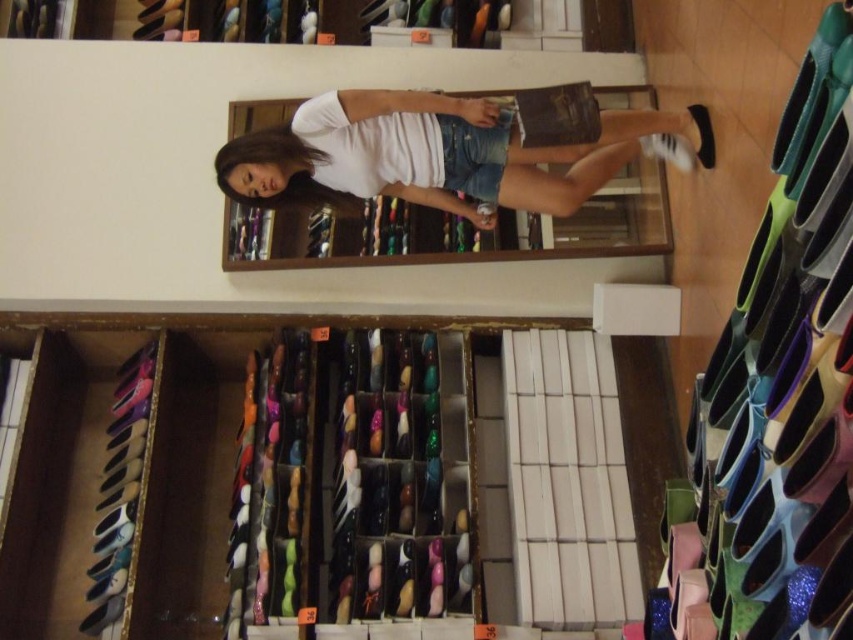
Question: Which object is positioned closest to the black matte shoe at upper right?

Choices:
 (A) wooden shoe rack at lower center
 (B) white matte sneaker at center

Answer: (B)

Question: Which object is positioned closest to the white matte sneaker at center?

Choices:
 (A) wooden shoe rack at lower center
 (B) black matte shoe at upper right
 (C) white matte shirt at upper center

Answer: (B)

Question: Is white matte shirt at upper center in front of black matte shoe at upper right?

Choices:
 (A) yes
 (B) no

Answer: (A)

Question: Is white matte shirt at upper center behind white matte sneaker at center?

Choices:
 (A) no
 (B) yes

Answer: (A)

Question: Is white matte shirt at upper center positioned at the back of black matte shoe at upper right?

Choices:
 (A) yes
 (B) no

Answer: (B)

Question: Which object is positioned farthest from the wooden shoe rack at lower center?

Choices:
 (A) black matte shoe at upper right
 (B) white matte shirt at upper center
 (C) white matte sneaker at center

Answer: (A)